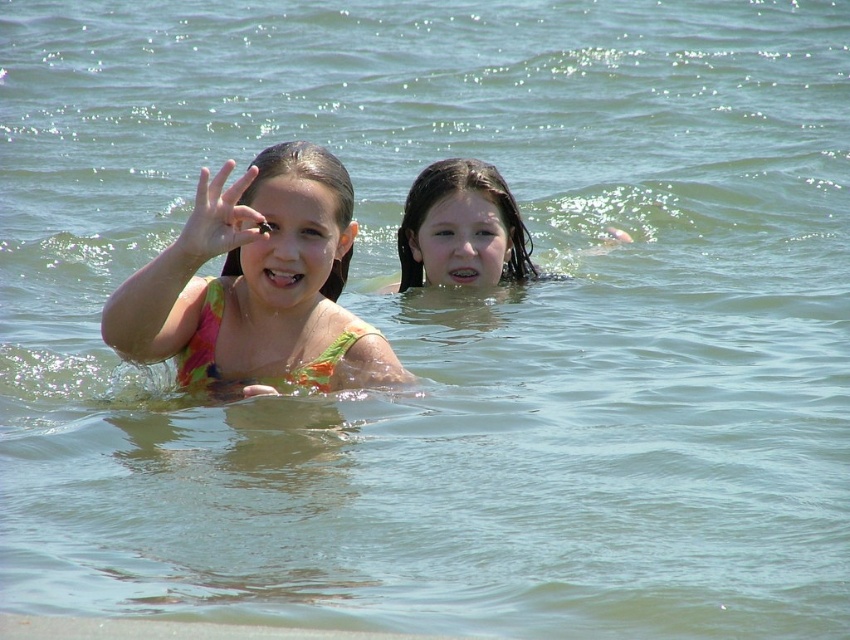
Consider the image. What are the coordinates of the multicolored fabric bikini at center in the image?

The multicolored fabric bikini at center is located at coordinates point (256, 284).

You are a photographer trying to capture the two girls in the scene. You notice two points marked in the image. Which point, point (298,324) or point (434,260), is closer to you as the photographer?

Point (298,324) is closer to the photographer than point (434,260).

You are a photographer trying to capture a candid shot of the girls in the water. You want to ensure that the multicolored fabric bikini at center and the wet hair at center are both visible in your frame. Based on their positions, which object should you focus on first to include both in the shot?

The multicolored fabric bikini at center is to the left of wet hair at center, so focusing on the multicolored fabric bikini at center first would help include both in the shot since it is positioned to the left side.